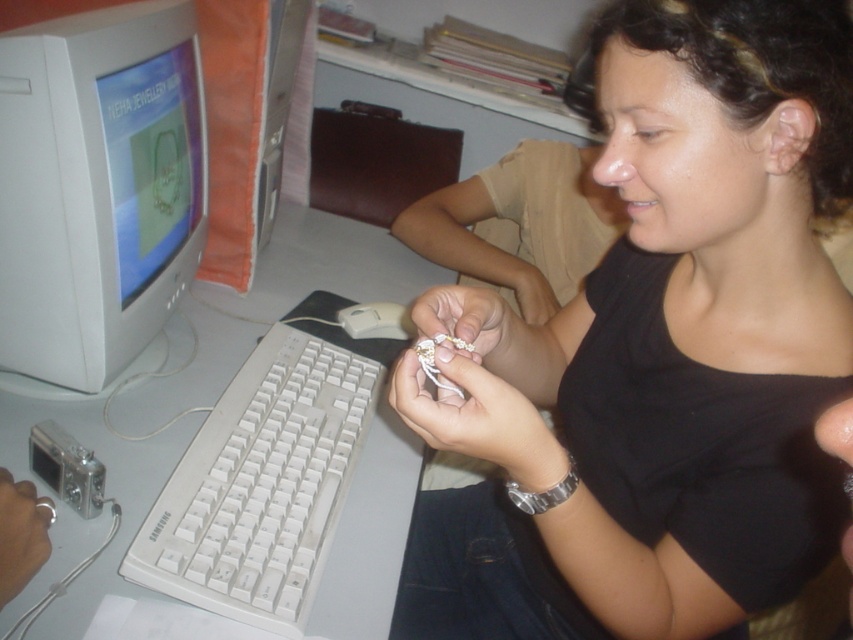
You are a photographer trying to capture the metallic ring at lower left without the matte black shirt at center blocking the view. Is this possible given their positions?

The matte black shirt at center is closer to the viewer than the metallic ring at lower left, so the shirt would block the view of the ring unless the camera angle is adjusted to avoid it.

You are standing at the position of the viewer in the image. There is a point marked at coordinates (100, 124) on the desk. If you want to reach that point without moving your feet, can you comfortably extend your hand to touch it?

The point at coordinates (100, 124) is 28.00 inches away from the viewer. Since the average arm length is about 27 inches, it might be slightly out of reach without moving closer.

You are a delivery person who needs to place a 24 inch box on the desk without moving any existing items. Is there enough space between the white plastic monitor at left and the edge of the desk to fit the box?

The distance between the white plastic monitor at left and the edge of the desk is 25.02 inches, which is more than enough to fit a 24 inch box without moving any items.